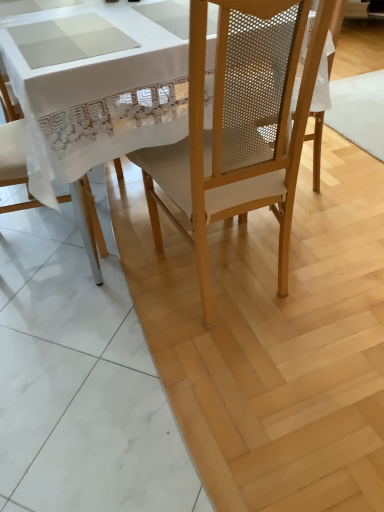
The width and height of the screenshot is (384, 512). Find the location of `vacant region in front of matte wood chair at center, the 1th chair when ordered from right to left`. vacant region in front of matte wood chair at center, the 1th chair when ordered from right to left is located at coordinates (236, 362).